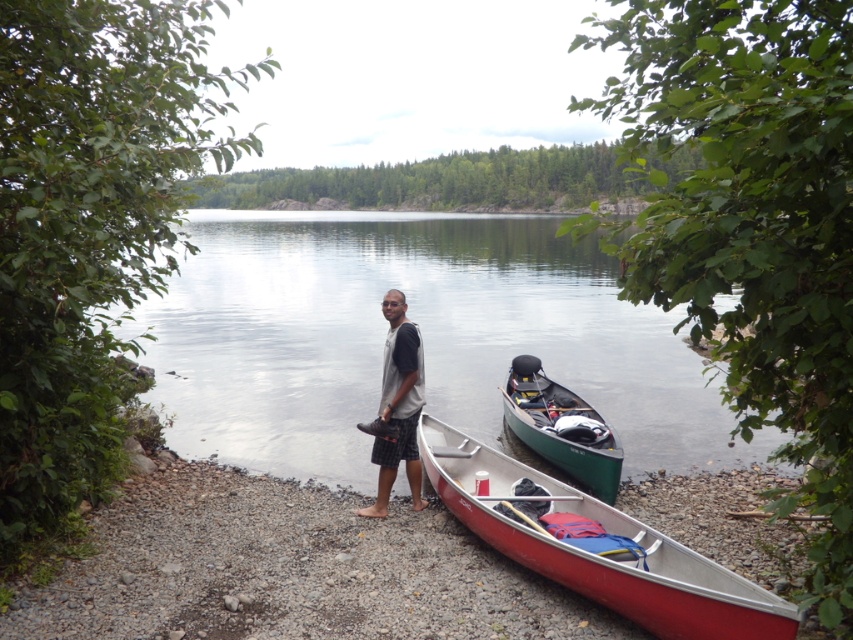
You are planning to store these canoes in a garage that has a 10 feet long storage space. Given that the red aluminum canoe at lower center is shorter than the green matte canoe at center, can both canoes fit side by side in the garage if the total length required is 18 feet?

The red aluminum canoe at lower center is shorter than the green matte canoe at center, but their combined length is 18 feet. Since the garage only has 10 feet of space, both canoes cannot fit side by side in the garage.

You are a photographer standing at the edge of the lake. You want to take a photo of the smooth water at center and the gray fabric shirt at center in the same frame. The camera you have can only focus on objects within 15 meters of each other. Will both objects be in focus?

The smooth water at center and gray fabric shirt at center are 17.08 meters apart from each other, which is beyond the camera focus range of 15 meters. Therefore, both objects cannot be in focus at the same time.

You are standing at the point labeled point (666, 541) and want to walk to the point labeled point (561, 412). Based on the scene description, which direction should you face to move towards your destination?

To move from point (666, 541) to point (561, 412), you should face towards the direction of the green canoe since point (561, 412) is behind point (666, 541).